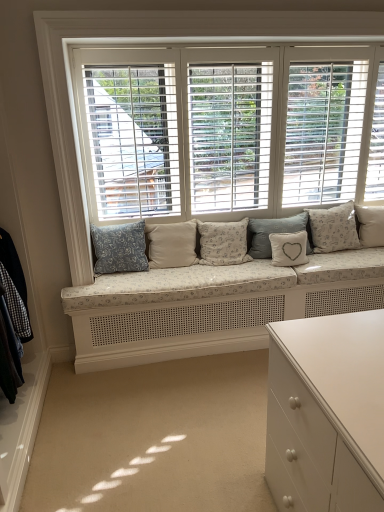
Measure the distance between blue floral fabric pillow at center, which ranks as the 7th pillow in right-to-left order, and camera.

blue floral fabric pillow at center, which ranks as the 7th pillow in right-to-left order, and camera are 8.87 feet apart.

What is the approximate height of fluffy white pillow at center, the third pillow when ordered from left to right?

fluffy white pillow at center, the third pillow when ordered from left to right, is 16.67 inches in height.

Identify the location of white wood window at center. (228, 130).

This screenshot has height=512, width=384. In order to click on white textured cushion at center, arranged as the sixth pillow when viewed from the left in this screenshot , I will do `click(334, 228)`.

Locate an element on the screen. This screenshot has width=384, height=512. white textured pillow at center, the 5th pillow when ordered from left to right is located at coordinates coord(288,248).

Is gray fabric pillow at center, the 4th pillow when ordered from left to right, inside or outside of white textured pillow at center, placed as the third pillow when sorted from right to left?

gray fabric pillow at center, the 4th pillow when ordered from left to right, is located beyond the bounds of white textured pillow at center, placed as the third pillow when sorted from right to left.

In terms of height, does gray fabric pillow at center, the fourth pillow when ordered from right to left, look taller or shorter compared to white textured pillow at center, the 5th pillow when ordered from left to right?

In the image, gray fabric pillow at center, the fourth pillow when ordered from right to left, appears to be taller than white textured pillow at center, the 5th pillow when ordered from left to right.

From a real-world perspective, is gray fabric pillow at center, the fourth pillow when ordered from right to left, positioned above or below white textured pillow at center, the 5th pillow when ordered from left to right?

In terms of real-world spatial position, gray fabric pillow at center, the fourth pillow when ordered from right to left, is above white textured pillow at center, the 5th pillow when ordered from left to right.

Is fluffy white pillow at center, the third pillow when ordered from left to right, a part of white textured cushion at center, the 2th pillow positioned from the right?

No, fluffy white pillow at center, the third pillow when ordered from left to right, is not surrounded by white textured cushion at center, the 2th pillow positioned from the right.

How distant is white textured cushion at center, arranged as the sixth pillow when viewed from the left, from fluffy white pillow at center, arranged as the fifth pillow when viewed from the right?

They are 64.72 centimeters apart.

Is white textured cushion at center, arranged as the sixth pillow when viewed from the left, shorter than fluffy white pillow at center, the third pillow when ordered from left to right?

Correct, white textured cushion at center, arranged as the sixth pillow when viewed from the left, is not as tall as fluffy white pillow at center, the third pillow when ordered from left to right.

Based on the photo, between white textured cushion at center, the 2th pillow positioned from the right, and fluffy white pillow at center, arranged as the fifth pillow when viewed from the right, which one has smaller width?

Thinner between the two is white textured cushion at center, the 2th pillow positioned from the right.

From the image's perspective, which one is positioned higher, white textured cushion at center, the 2th pillow positioned from the right, or gray fabric pillow at center, the 4th pillow when ordered from left to right?

white textured cushion at center, the 2th pillow positioned from the right, appears higher in the image.

Is the surface of white textured cushion at center, the 2th pillow positioned from the right, in direct contact with gray fabric pillow at center, the fourth pillow when ordered from right to left?

white textured cushion at center, the 2th pillow positioned from the right, and gray fabric pillow at center, the fourth pillow when ordered from right to left, are clearly separated.

From a real-world perspective, which is physically above, white textured cushion at center, arranged as the sixth pillow when viewed from the left, or gray fabric pillow at center, the 4th pillow when ordered from left to right?

white textured cushion at center, arranged as the sixth pillow when viewed from the left, from a real-world perspective.

Is gray fabric pillow at center, the 4th pillow when ordered from left to right, surrounding white wood window at center?

No, white wood window at center is not inside gray fabric pillow at center, the 4th pillow when ordered from left to right.

From the picture: Is gray fabric pillow at center, the fourth pillow when ordered from right to left, aimed at white wood window at center?

No, gray fabric pillow at center, the fourth pillow when ordered from right to left, is not aimed at white wood window at center.

Looking at this image, is gray fabric pillow at center, the 4th pillow when ordered from left to right, positioned in front of white wood window at center?

No, gray fabric pillow at center, the 4th pillow when ordered from left to right, is further to the viewer.

Could you measure the distance between gray fabric pillow at center, the fourth pillow when ordered from right to left, and white wood window at center?

gray fabric pillow at center, the fourth pillow when ordered from right to left, and white wood window at center are 24.25 inches apart.

Can we say white wood window at center lies outside beige fabric pillow at center, which ranks as the sixth pillow in right-to-left order?

Yes, white wood window at center is located beyond the bounds of beige fabric pillow at center, which ranks as the sixth pillow in right-to-left order.

Is white wood window at center positioned behind beige fabric pillow at center, placed as the second pillow when sorted from left to right?

No, it is in front of beige fabric pillow at center, placed as the second pillow when sorted from left to right.

Which point is more distant from viewer, (x=330, y=192) or (x=156, y=234)?

The point (x=330, y=192) is more distant.

Is white wood window at center taller or shorter than beige fabric pillow at center, which ranks as the sixth pillow in right-to-left order?

white wood window at center is taller than beige fabric pillow at center, which ranks as the sixth pillow in right-to-left order.

Can you tell me how much gray fabric pillow at center, the fourth pillow when ordered from right to left, and white textured pillow at right, which appears as the first pillow when viewed from the right, differ in facing direction?

1.58 degrees.

Considering the relative sizes of gray fabric pillow at center, the 4th pillow when ordered from left to right, and white textured pillow at right, placed as the seventh pillow when sorted from left to right, in the image provided, is gray fabric pillow at center, the 4th pillow when ordered from left to right, thinner than white textured pillow at right, placed as the seventh pillow when sorted from left to right,?

No, gray fabric pillow at center, the 4th pillow when ordered from left to right, is not thinner than white textured pillow at right, placed as the seventh pillow when sorted from left to right.

Between gray fabric pillow at center, the 4th pillow when ordered from left to right, and white textured pillow at right, placed as the seventh pillow when sorted from left to right, which one has larger size?

gray fabric pillow at center, the 4th pillow when ordered from left to right.

From the image's perspective, which object appears higher, gray fabric pillow at center, the fourth pillow when ordered from right to left, or white textured pillow at right, which appears as the first pillow when viewed from the right?

white textured pillow at right, which appears as the first pillow when viewed from the right.

Which of these two, beige fabric pillow at center, placed as the second pillow when sorted from left to right, or white wood window at center, is smaller?

beige fabric pillow at center, placed as the second pillow when sorted from left to right, is smaller.

There is a white wood window at center. Where is `the 5th pillow below it (from a real-world perspective)`? This screenshot has height=512, width=384. the 5th pillow below it (from a real-world perspective) is located at coordinates (171, 245).

Does beige fabric pillow at center, which ranks as the sixth pillow in right-to-left order, have a lesser height compared to white wood window at center?

Yes, beige fabric pillow at center, which ranks as the sixth pillow in right-to-left order, is shorter than white wood window at center.

Locate an element on the screen. the 3rd pillow located above the white textured pillow at center, placed as the third pillow when sorted from right to left (from a real-world perspective) is located at coordinates (275, 232).

I want to click on the 3rd pillow to the left of the white textured cushion at center, the 2th pillow positioned from the right, counting from the anchor's position, so click(x=223, y=242).

Based on the photo, when comparing their distances from white textured pillow at right, which appears as the first pillow when viewed from the right, does white textured pillow at center, placed as the third pillow when sorted from right to left, or fluffy white pillow at center, the third pillow when ordered from left to right, seem closer?

white textured pillow at center, placed as the third pillow when sorted from right to left.

Looking at the image, which one is located further to white textured cushion at center, arranged as the sixth pillow when viewed from the left, white textured pillow at center, placed as the third pillow when sorted from right to left, or fluffy white pillow at center, the third pillow when ordered from left to right?

fluffy white pillow at center, the third pillow when ordered from left to right, is positioned further to the anchor white textured cushion at center, arranged as the sixth pillow when viewed from the left.

Based on their spatial positions, is white wood window at center or blue floral fabric pillow at center, the first pillow when ordered from left to right, further from gray fabric pillow at center, the 4th pillow when ordered from left to right?

Based on the image, blue floral fabric pillow at center, the first pillow when ordered from left to right, appears to be further to gray fabric pillow at center, the 4th pillow when ordered from left to right.

Consider the image. When comparing their distances from beige fabric pillow at center, placed as the second pillow when sorted from left to right, does white textured pillow at center, the 5th pillow when ordered from left to right, or white wood window at center seem closer?

The object closer to beige fabric pillow at center, placed as the second pillow when sorted from left to right, is white wood window at center.

Which object lies nearer to the anchor point white textured pillow at right, which appears as the first pillow when viewed from the right, beige fabric pillow at center, which ranks as the sixth pillow in right-to-left order, or white textured pillow at center, placed as the third pillow when sorted from right to left?

The object closer to white textured pillow at right, which appears as the first pillow when viewed from the right, is white textured pillow at center, placed as the third pillow when sorted from right to left.

Which object lies nearer to the anchor point white wood window at center, beige fabric pillow at center, placed as the second pillow when sorted from left to right, or gray fabric pillow at center, the fourth pillow when ordered from right to left?

The object closer to white wood window at center is gray fabric pillow at center, the fourth pillow when ordered from right to left.

Based on the photo, from the image, which object appears to be nearer to white textured cushion at center, arranged as the sixth pillow when viewed from the left, white wood window at center or beige fabric pillow at center, placed as the second pillow when sorted from left to right?

white wood window at center lies closer to white textured cushion at center, arranged as the sixth pillow when viewed from the left, than the other object.

From the image, which object appears to be farther from white textured pillow at center, the 5th pillow when ordered from left to right, blue floral fabric pillow at center, the first pillow when ordered from left to right, or white wood window at center?

blue floral fabric pillow at center, the first pillow when ordered from left to right.

Find the location of a particular element. window between blue floral fabric pillow at center, the first pillow when ordered from left to right, and white textured cushion at center, arranged as the sixth pillow when viewed from the left, in the horizontal direction is located at coordinates (228, 130).

This screenshot has height=512, width=384. Identify the location of pillow situated between white textured pillow at center, the 5th pillow when ordered from left to right, and white textured pillow at right, which appears as the first pillow when viewed from the right, from left to right. (334, 228).

The width and height of the screenshot is (384, 512). What are the coordinates of `window located between blue floral fabric pillow at center, which ranks as the 7th pillow in right-to-left order, and gray fabric pillow at center, the 4th pillow when ordered from left to right, in the left-right direction` in the screenshot? It's located at (228, 130).

What are the coordinates of `window between beige fabric pillow at center, which ranks as the sixth pillow in right-to-left order, and white textured cushion at center, arranged as the sixth pillow when viewed from the left, in the horizontal direction` in the screenshot? It's located at (228, 130).